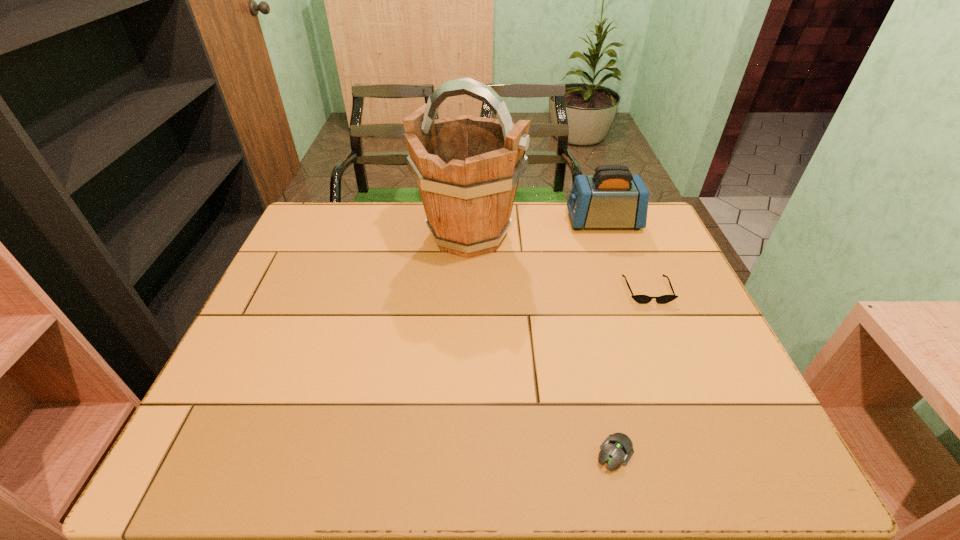
The image size is (960, 540). I want to click on free space at the near edge of the desktop, so click(281, 450).

This screenshot has height=540, width=960. In order to click on vacant space at the left edge of the desktop in this screenshot , I will do `click(239, 362)`.

Locate an element on the screen. The image size is (960, 540). vacant space at the right edge of the desktop is located at coordinates (644, 277).

In the image, there is a desktop. Where is `vacant space at the near right corner`? vacant space at the near right corner is located at coordinates (717, 432).

The height and width of the screenshot is (540, 960). In order to click on free space between the third tallest object and the leftmost object in this screenshot , I will do `click(558, 262)`.

The width and height of the screenshot is (960, 540). I want to click on free point between the third farthest object and the shortest object, so (631, 372).

The image size is (960, 540). In order to click on empty space that is in between the toaster and the bucket in this screenshot , I will do `click(536, 228)`.

Find the location of `unoccupied position between the second shortest object and the tallest object`. unoccupied position between the second shortest object and the tallest object is located at coordinates (558, 262).

This screenshot has width=960, height=540. Identify the location of free space that is in between the third shortest object and the leftmost object. (536, 228).

I want to click on vacant point located between the shortest object and the second shortest object, so click(x=631, y=372).